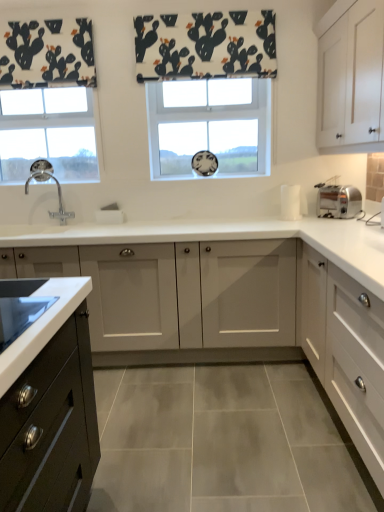
Image resolution: width=384 pixels, height=512 pixels. Find the location of `vacant space underneath white fabric with cactus print at upper center (from a real-world perspective)`. vacant space underneath white fabric with cactus print at upper center (from a real-world perspective) is located at coordinates (217, 215).